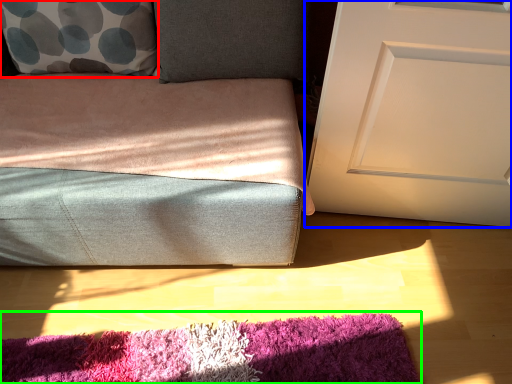
Question: Considering the real-world distances, which object is closest to throw pillow (highlighted by a red box)? door (highlighted by a blue box) or mat (highlighted by a green box).

Choices:
 (A) door
 (B) mat

Answer: (A)